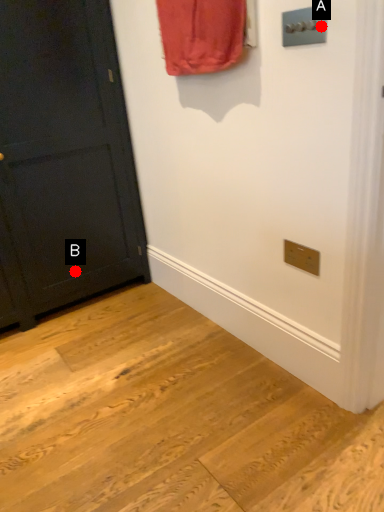
Question: Two points are circled on the image, labeled by A and B beside each circle. Which point is closer to the camera?

Choices:
 (A) A is closer
 (B) B is closer

Answer: (A)